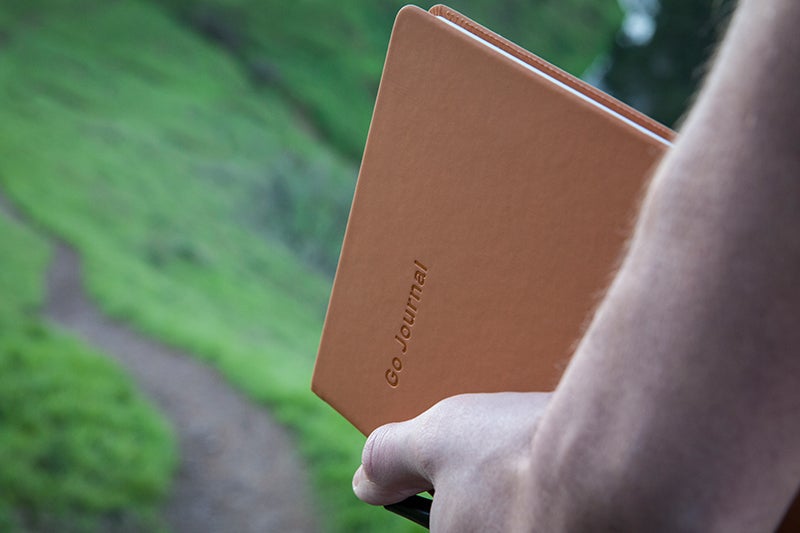
Find the location of a particular element. writing utensil is located at coordinates (408, 511).